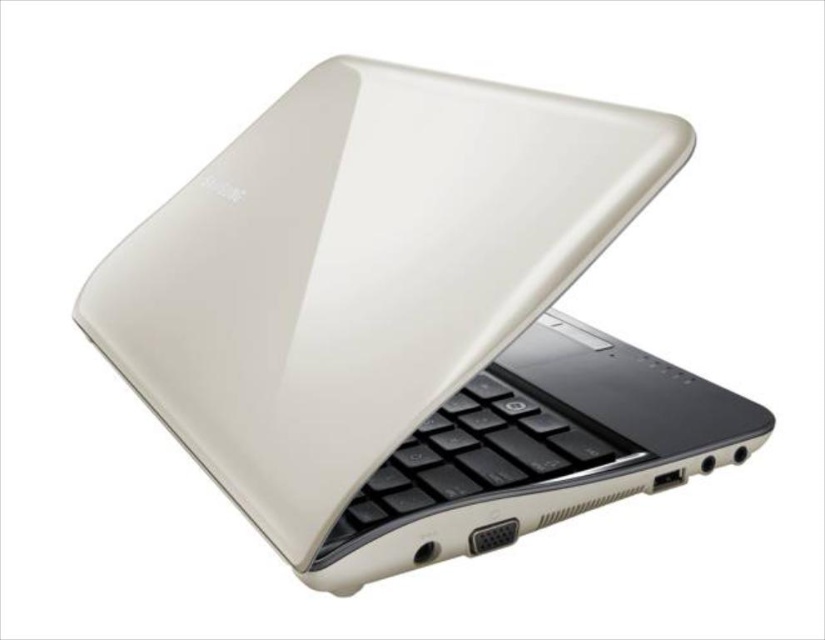
Question: Does satin white laptop at center appear under black matte keyboard at center?

Choices:
 (A) yes
 (B) no

Answer: (B)

Question: Among these objects, which one is nearest to the camera?

Choices:
 (A) black matte keyboard at center
 (B) satin white laptop at center

Answer: (B)

Question: Is satin white laptop at center to the left of black matte keyboard at center from the viewer's perspective?

Choices:
 (A) yes
 (B) no

Answer: (A)

Question: Which point is closer to the camera?

Choices:
 (A) satin white laptop at center
 (B) black matte keyboard at center

Answer: (A)

Question: Is satin white laptop at center smaller than black matte keyboard at center?

Choices:
 (A) no
 (B) yes

Answer: (A)